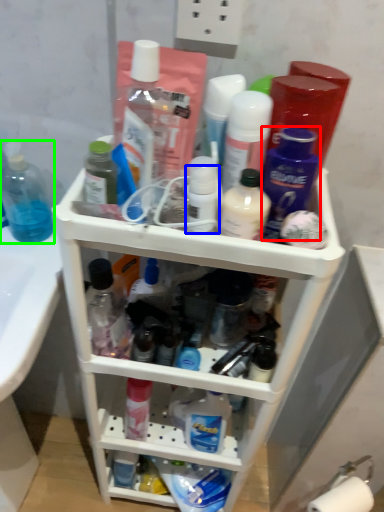
Question: Estimate the real-world distances between objects in this image. Which object is closer to toiletry (highlighted by a red box), toiletry (highlighted by a blue box) or bottle (highlighted by a green box)?

Choices:
 (A) toiletry
 (B) bottle

Answer: (A)